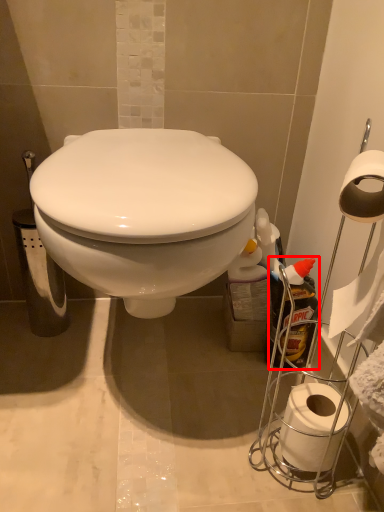
Question: From the image's perspective, where is cleaning product (annotated by the red box) located relative to toilet paper?

Choices:
 (A) above
 (B) below

Answer: (A)